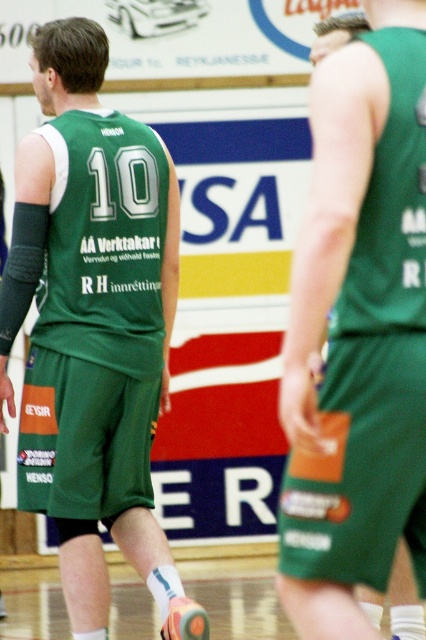
Question: Considering the relative positions of green matte jersey at center and green matte shorts at center in the image provided, where is green matte jersey at center located with respect to green matte shorts at center?

Choices:
 (A) right
 (B) left

Answer: (B)

Question: Which point is closer to the camera taking this photo?

Choices:
 (A) (46, 289)
 (B) (348, 608)

Answer: (B)

Question: Where is green matte jersey at center located in relation to green matte shorts at center in the image?

Choices:
 (A) above
 (B) below

Answer: (B)

Question: Which point is closer to the camera?

Choices:
 (A) (129, 241)
 (B) (376, 52)

Answer: (B)

Question: Which of the following is the farthest from the observer?

Choices:
 (A) (16, 307)
 (B) (333, 67)

Answer: (A)

Question: Is green matte jersey at center to the left of green matte shorts at center from the viewer's perspective?

Choices:
 (A) no
 (B) yes

Answer: (B)